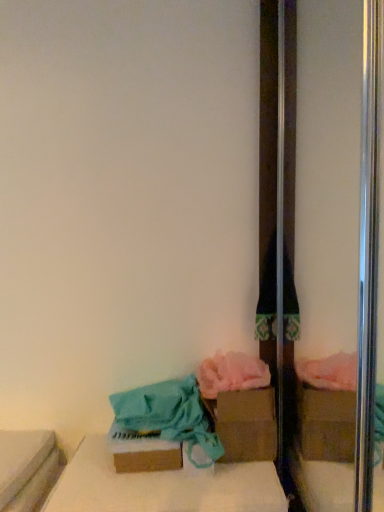
Question: From the image's perspective, does teal fabric bag at lower left, the first material in the left-to-right sequence, appear lower than brown cardboard box at center, placed as the 1th cardboard box when sorted from back to front?

Choices:
 (A) no
 (B) yes

Answer: (B)

Question: From a real-world perspective, is teal fabric bag at lower left, the first material in the left-to-right sequence, positioned over brown cardboard box at center, the first cardboard box from the right, based on gravity?

Choices:
 (A) no
 (B) yes

Answer: (B)

Question: Is teal fabric bag at lower left, the first material in the left-to-right sequence, smaller than brown cardboard box at center, arranged as the second cardboard box when viewed from the left?

Choices:
 (A) yes
 (B) no

Answer: (B)

Question: Is teal fabric bag at lower left, the first material in the left-to-right sequence, oriented away from brown cardboard box at center, arranged as the second cardboard box when viewed from the left?

Choices:
 (A) yes
 (B) no

Answer: (B)

Question: Can you confirm if teal fabric bag at lower left, the 2th material in the right-to-left sequence, is wider than brown cardboard box at center, placed as the 1th cardboard box when sorted from back to front?

Choices:
 (A) yes
 (B) no

Answer: (A)

Question: Considering the positions of point (251, 455) and point (240, 359), is point (251, 455) closer or farther from the camera than point (240, 359)?

Choices:
 (A) closer
 (B) farther

Answer: (A)

Question: Looking at the image, does brown cardboard box at center, placed as the 1th cardboard box when sorted from back to front, seem bigger or smaller compared to pink fluffy towel at lower center, which is the 2th material from left to right?

Choices:
 (A) big
 (B) small

Answer: (A)

Question: Is brown cardboard box at center, placed as the 1th cardboard box when sorted from back to front, inside or outside of pink fluffy towel at lower center, marked as the first material in a right-to-left arrangement?

Choices:
 (A) outside
 (B) inside

Answer: (A)

Question: In the image, is brown cardboard box at center, the first cardboard box from the right, positioned in front of or behind pink fluffy towel at lower center, which is the 2th material from left to right?

Choices:
 (A) behind
 (B) front

Answer: (A)

Question: Would you say brown cardboard box at lower center, which is the 1th cardboard box from left to right, is to the left or to the right of brown cardboard box at lower center in the picture?

Choices:
 (A) right
 (B) left

Answer: (B)

Question: Considering the positions of brown cardboard box at lower center, the first cardboard box positioned from the front, and brown cardboard box at lower center in the image, is brown cardboard box at lower center, the first cardboard box positioned from the front, wider or thinner than brown cardboard box at lower center?

Choices:
 (A) wide
 (B) thin

Answer: (B)

Question: From the image's perspective, relative to brown cardboard box at lower center, is brown cardboard box at lower center, the second cardboard box from the back, above or below?

Choices:
 (A) above
 (B) below

Answer: (A)

Question: In the image, is brown cardboard box at lower center, the first cardboard box positioned from the front, positioned in front of or behind brown cardboard box at lower center?

Choices:
 (A) front
 (B) behind

Answer: (B)

Question: From the image's perspective, is brown cardboard box at lower center located above or below teal fabric bag at lower left, the first material in the left-to-right sequence?

Choices:
 (A) above
 (B) below

Answer: (B)

Question: From a real-world perspective, relative to teal fabric bag at lower left, the first material in the left-to-right sequence, is brown cardboard box at lower center vertically above or below?

Choices:
 (A) above
 (B) below

Answer: (B)